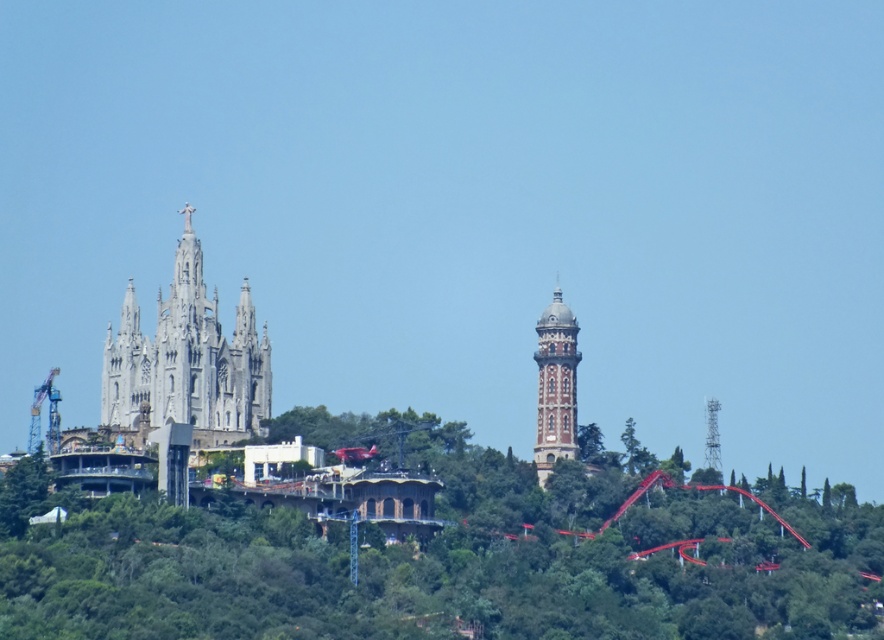
You are a hiker who wants to take a photo of the white stone church at left and the green leafy tree at center from the best angle. Which object should you stand closer to in order to capture both in the same frame?

You should stand closer to the green leafy tree at center because the white stone church at left is positioned on the left side of green leafy tree at center, so moving closer to the tree will help include both in the frame.

You are standing at the center of the hilltop and want to visit the white stone church at left. Which direction should you walk to reach it?

The white stone church at left is located at point (187, 360), which means it is to your left side. You should walk towards your left to reach it.